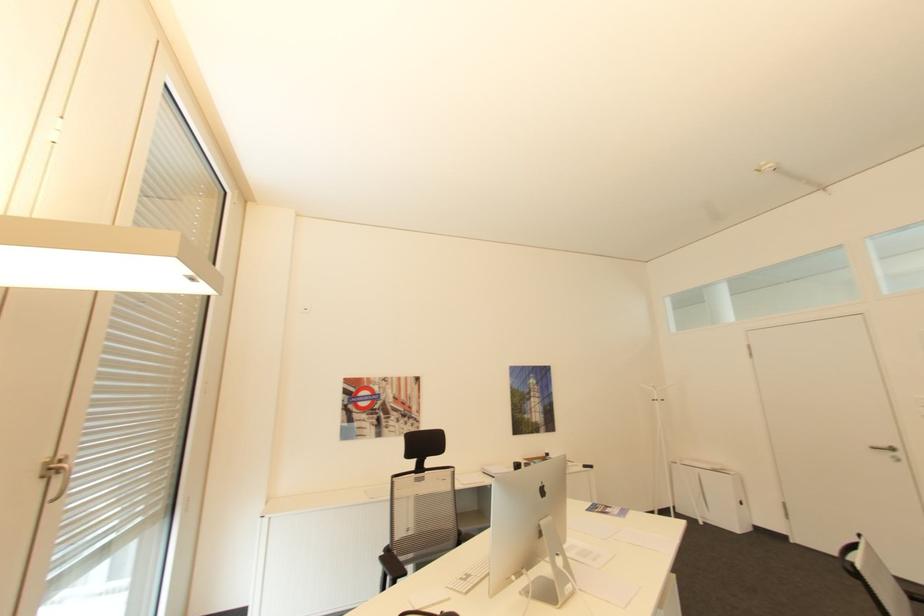
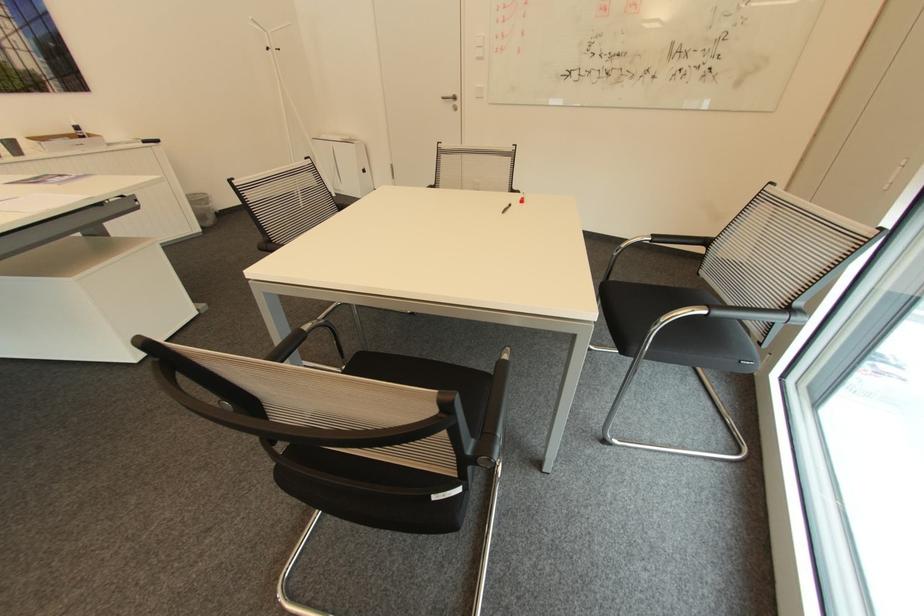
The point at [747,503] is marked in the first image. Where is the corresponding point in the second image?

(369, 171)